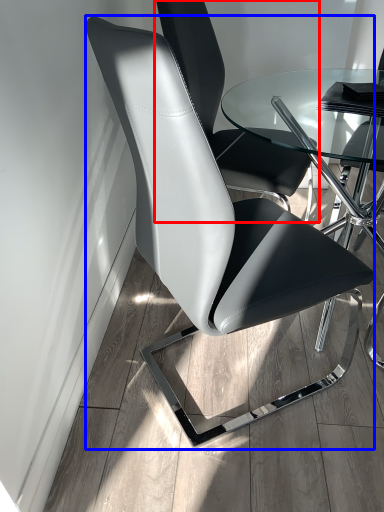
Question: Which of the following is the farthest to the observer, chair (highlighted by a red box) or chair (highlighted by a blue box)?

Choices:
 (A) chair
 (B) chair

Answer: (A)